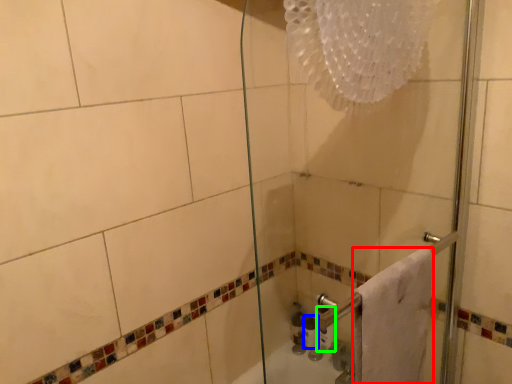
Question: Which object is the closest to the towel (highlighted by a red box)? Choose among these: toiletry (highlighted by a blue box) or toilet paper (highlighted by a green box).

Choices:
 (A) toiletry
 (B) toilet paper

Answer: (B)